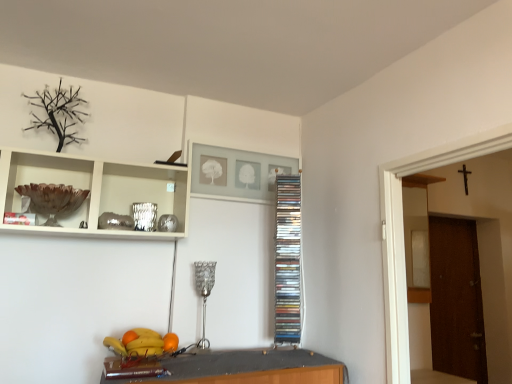
Question: Does shiny plastic bowl at lower center appear on the right side of orange matte at lower center, marked as the first orange in a left-to-right arrangement?

Choices:
 (A) yes
 (B) no

Answer: (A)

Question: Is the surface of shiny plastic bowl at lower center in direct contact with orange matte at lower center, arranged as the 2th orange when viewed from the right?

Choices:
 (A) no
 (B) yes

Answer: (B)

Question: From the image's perspective, is shiny plastic bowl at lower center located above orange matte at lower center, marked as the first orange in a left-to-right arrangement?

Choices:
 (A) yes
 (B) no

Answer: (B)

Question: Does shiny plastic bowl at lower center have a larger size compared to orange matte at lower center, marked as the first orange in a left-to-right arrangement?

Choices:
 (A) yes
 (B) no

Answer: (A)

Question: From a real-world perspective, does shiny plastic bowl at lower center sit lower than orange matte at lower center, arranged as the 2th orange when viewed from the right?

Choices:
 (A) no
 (B) yes

Answer: (B)

Question: Can you confirm if shiny plastic bowl at lower center is taller than orange matte at lower center, arranged as the 2th orange when viewed from the right?

Choices:
 (A) no
 (B) yes

Answer: (B)

Question: Is orange matte at lower center, the first orange positioned from the right, to the right of orange matte at lower center, marked as the first orange in a left-to-right arrangement, from the viewer's perspective?

Choices:
 (A) yes
 (B) no

Answer: (A)

Question: Could you tell me if orange matte at lower center, the first orange positioned from the right, is facing orange matte at lower center, arranged as the 2th orange when viewed from the right?

Choices:
 (A) no
 (B) yes

Answer: (A)

Question: Is orange matte at lower center, the first orange positioned from the right, outside orange matte at lower center, marked as the first orange in a left-to-right arrangement?

Choices:
 (A) yes
 (B) no

Answer: (A)

Question: Considering the relative sizes of orange matte at lower center, the second orange in the left-to-right sequence, and orange matte at lower center, arranged as the 2th orange when viewed from the right, in the image provided, is orange matte at lower center, the second orange in the left-to-right sequence, smaller than orange matte at lower center, arranged as the 2th orange when viewed from the right,?

Choices:
 (A) no
 (B) yes

Answer: (A)

Question: Is orange matte at lower center, the first orange positioned from the right, further to the viewer compared to orange matte at lower center, marked as the first orange in a left-to-right arrangement?

Choices:
 (A) yes
 (B) no

Answer: (A)

Question: From the image's perspective, is orange matte at lower center, the second orange in the left-to-right sequence, over orange matte at lower center, arranged as the 2th orange when viewed from the right?

Choices:
 (A) no
 (B) yes

Answer: (A)

Question: Are silver metallic lamp at center and shiny plastic bowl at lower center far apart?

Choices:
 (A) no
 (B) yes

Answer: (A)